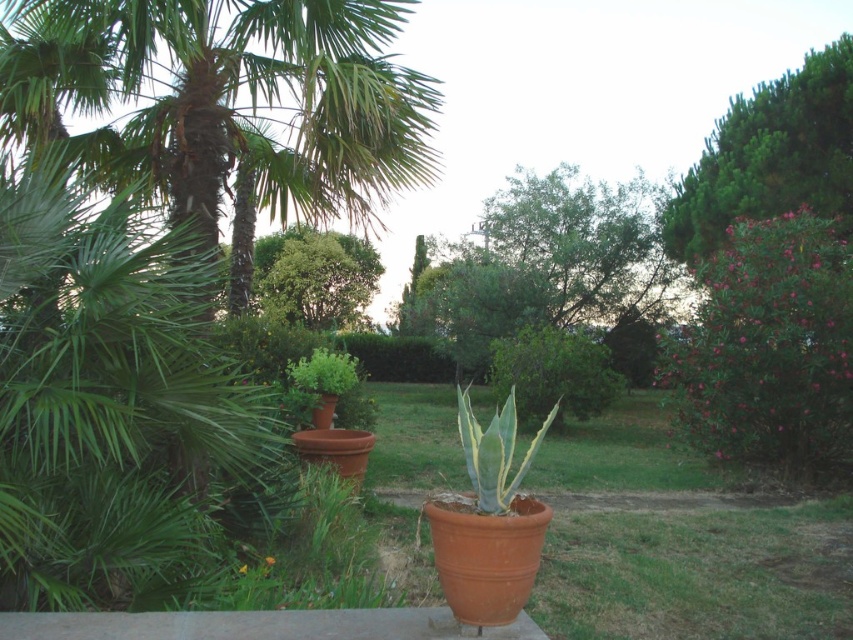
Question: Which point is closer to the camera?

Choices:
 (A) (305, 307)
 (B) (341, 212)

Answer: (B)

Question: Can you confirm if green leafy bush at upper center is smaller than green leafy bush at center?

Choices:
 (A) yes
 (B) no

Answer: (A)

Question: Does pink glossy bush at upper right appear on the right side of green leafy bush at upper center?

Choices:
 (A) no
 (B) yes

Answer: (B)

Question: Which point appears farthest from the camera in this image?

Choices:
 (A) (666, 237)
 (B) (260, 257)

Answer: (B)

Question: Can you confirm if green leafy palm at upper left is smaller than pink glossy bush at upper right?

Choices:
 (A) yes
 (B) no

Answer: (B)

Question: Which point appears farthest from the camera in this image?

Choices:
 (A) (541, 364)
 (B) (271, 122)
 (C) (850, 368)

Answer: (A)